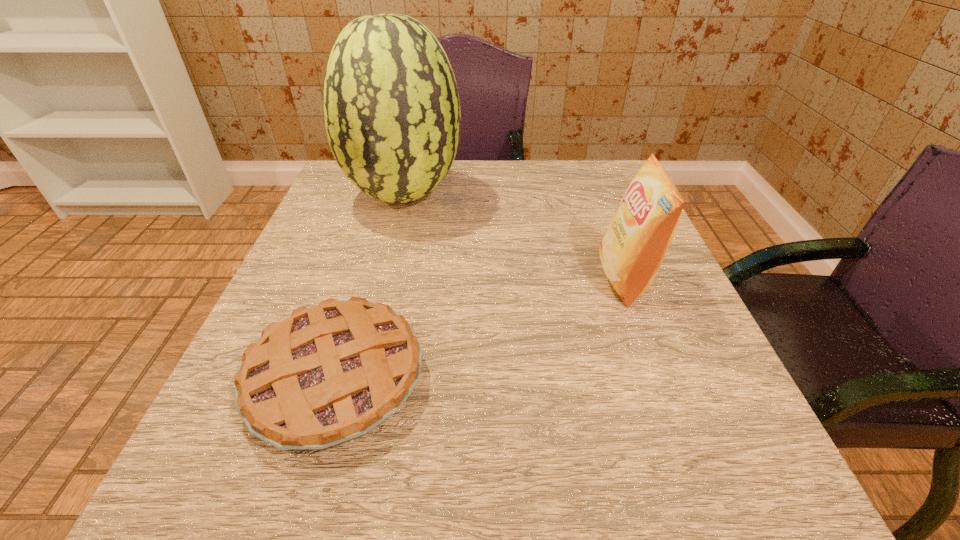
Find the location of `free space that is in between the farthest object and the second tallest object`. free space that is in between the farthest object and the second tallest object is located at coordinates (515, 237).

Locate an element on the screen. The height and width of the screenshot is (540, 960). blank region between the pie and the tallest object is located at coordinates [371, 287].

Find the location of a particular element. The width and height of the screenshot is (960, 540). vacant area that lies between the watermelon and the nearest object is located at coordinates (371, 287).

Identify the location of vacant area that lies between the rightmost object and the shortest object. (481, 329).

Identify which object is located as the nearest to the nearest object. Please provide its 2D coordinates. Your answer should be formatted as a tuple, i.e. [(x, y)], where the tuple contains the x and y coordinates of a point satisfying the conditions above.

[(392, 114)]

The width and height of the screenshot is (960, 540). What are the coordinates of `object that stands as the closest to the crisp (potato chip)` in the screenshot? It's located at (392, 114).

The image size is (960, 540). I want to click on vacant position in the image that satisfies the following two spatial constraints: 1. on the back side of the shortest object; 2. on the right side of the farthest object, so click(391, 196).

At what (x,y) coordinates should I click in order to perform the action: click on blank space that satisfies the following two spatial constraints: 1. on the front-facing side of the second farthest object; 2. on the front side of the shortest object. Please return your answer as a coordinate pair (x, y). Looking at the image, I should click on (662, 379).